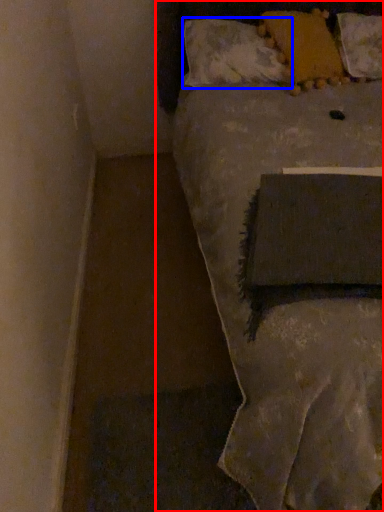
Question: Which object is further to the camera taking this photo, bed (highlighted by a red box) or pillow (highlighted by a blue box)?

Choices:
 (A) bed
 (B) pillow

Answer: (B)